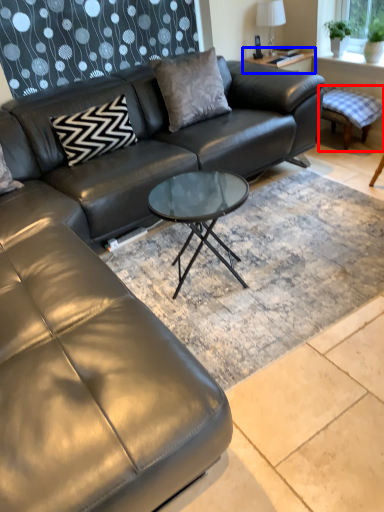
Question: Which object appears closest to the camera in this image, swivel chair (highlighted by a red box) or side table (highlighted by a blue box)?

Choices:
 (A) swivel chair
 (B) side table

Answer: (A)